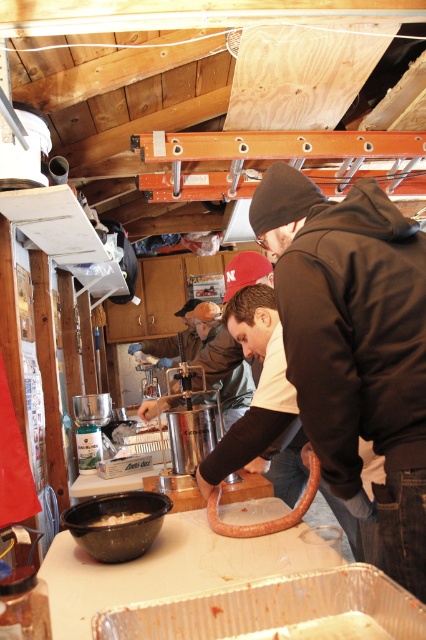
You are organizing a sausage making event and need to place a decorative item on the taller object between the black matte jacket at center and the white matte bowl at lower left. Which object should you choose?

The black matte jacket at center is taller than the white matte bowl at lower left, so you should place the decorative item on the black matte jacket at center.

You are organizing a sausage making workshop and need to place a white matte bowl at lower left on a shelf. However, there is a black matte jacket at center currently blocking the area. Which object should you move to access the shelf?

The black matte jacket at center is in front of the white matte bowl at lower left, so you should move the black matte jacket at center to access the shelf.

You are a photographer holding a camera and need to take a closeup shot of the black matte jacket at center. Can you move closer to the jacket without moving the camera? Explain your reasoning based on the distance provided.

The black matte jacket at center and camera are 3.29 feet apart from each other. Since you can move closer to the jacket while keeping the camera stationary, you can reduce the distance to achieve a closeup shot.